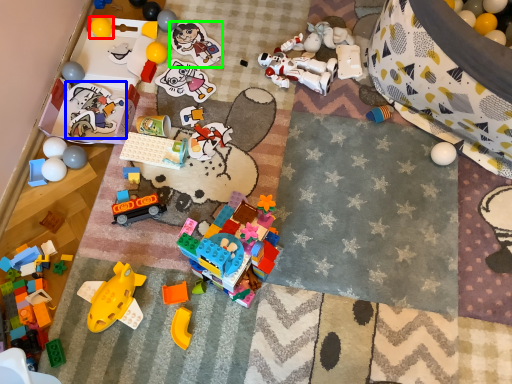
Question: Based on their relative distances, which object is nearer to toy (highlighted by a red box)? Choose from toy (highlighted by a blue box) and toy (highlighted by a green box).

Choices:
 (A) toy
 (B) toy

Answer: (A)